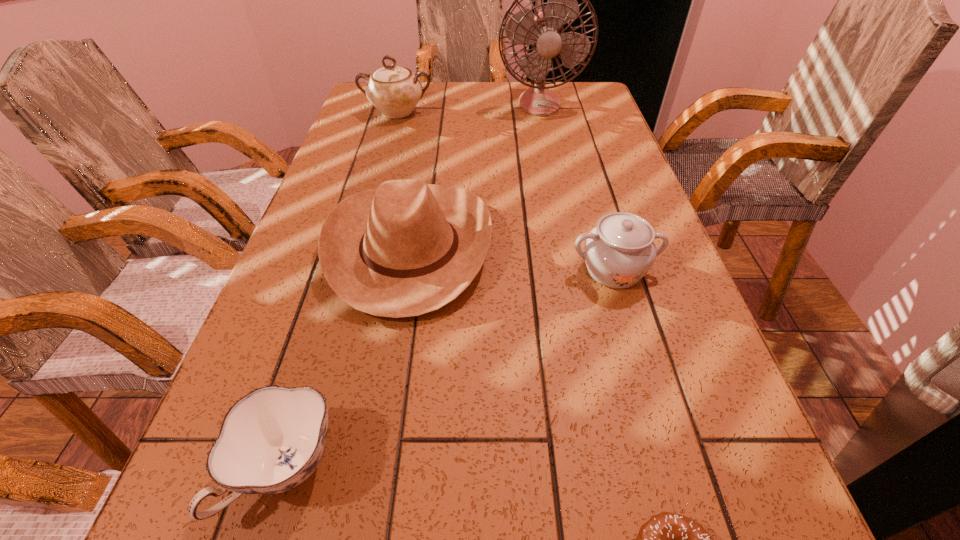
Identify which object is the fifth nearest to the tallest chinaware. Please provide its 2D coordinates. Your answer should be formatted as a tuple, i.e. [(x, y)], where the tuple contains the x and y coordinates of a point satisfying the conditions above.

[(667, 539)]

Choose which chinaware is the nearest neighbor to the nearest chinaware. Please provide its 2D coordinates. Your answer should be formatted as a tuple, i.e. [(x, y)], where the tuple contains the x and y coordinates of a point satisfying the conditions above.

[(620, 250)]

Identify which chinaware is located as the third nearest to the shortest object. Please provide its 2D coordinates. Your answer should be formatted as a tuple, i.e. [(x, y)], where the tuple contains the x and y coordinates of a point satisfying the conditions above.

[(395, 91)]

Locate an element on the screen. This screenshot has height=540, width=960. vacant space that satisfies the following two spatial constraints: 1. on the front side of the farthest chinaware; 2. on the right side of the second tallest chinaware is located at coordinates (352, 270).

Identify the location of free spot that satisfies the following two spatial constraints: 1. on the front-facing side of the second nearest chinaware; 2. on the right side of the cowboy hat. (406, 270).